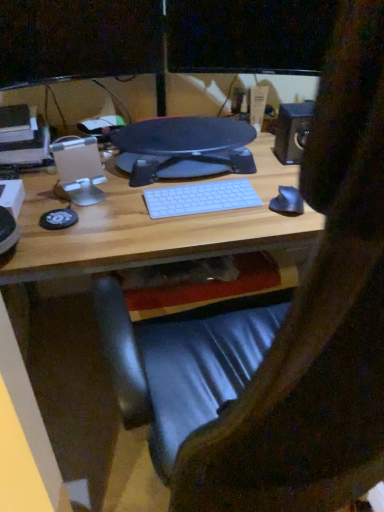
Where is `free space in front of white matte keyboard at center`? The height and width of the screenshot is (512, 384). free space in front of white matte keyboard at center is located at coordinates (192, 229).